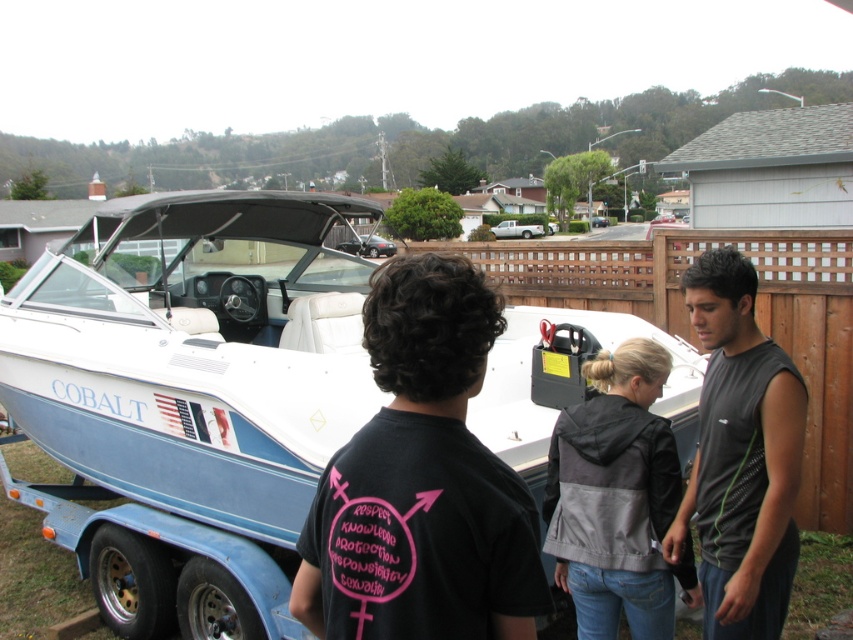
Describe the element at coordinates (190, 396) in the screenshot. The width and height of the screenshot is (853, 640). I see `white glossy boat at center` at that location.

Between point (219, 625) and point (704, 320), which one is positioned behind?

Positioned behind is point (219, 625).

The image size is (853, 640). Identify the location of white glossy boat at center. tap(190, 396).

Which of these two, black matte shirt at center or gray fabric jacket at center, stands taller?

Standing taller between the two is gray fabric jacket at center.

Who is positioned more to the left, black matte shirt at center or gray fabric jacket at center?

Positioned to the left is black matte shirt at center.

The image size is (853, 640). What are the coordinates of `black matte shirt at center` in the screenshot? It's located at (422, 481).

Identify the location of black matte shirt at center. (422, 481).

Is point (276, 440) positioned behind point (444, 474)?

That is True.

Who is more forward, (323, 212) or (476, 275)?

Point (476, 275) is in front.

Between point (180, 452) and point (468, 449), which one is positioned behind?

Positioned behind is point (180, 452).

In order to click on white glossy boat at center in this screenshot , I will do `click(190, 396)`.